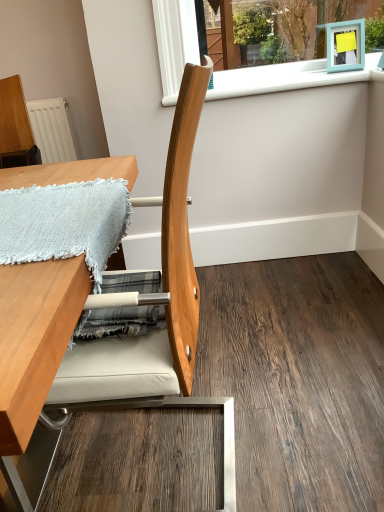
The image size is (384, 512). Describe the element at coordinates (33, 348) in the screenshot. I see `wooden table at left` at that location.

Locate an element on the screen. light blue woven blanket at upper left is located at coordinates (65, 223).

Is white plastic window sill at upper center positioned far away from wooden table at left?

No, white plastic window sill at upper center is not far away from wooden table at left.

Can you confirm if white plastic window sill at upper center is positioned to the right of wooden table at left?

Correct, you'll find white plastic window sill at upper center to the right of wooden table at left.

Which of these two, white plastic window sill at upper center or wooden table at left, stands taller?

Standing taller between the two is wooden table at left.

How different are the orientations of white plastic window sill at upper center and wooden table at left in degrees?

89.4 degrees.

From a real-world perspective, which object rests below the other?

light blue woven blanket at upper left.

Is white plastic window sill at upper center beside light blue woven blanket at upper left?

No.

Could light blue woven blanket at upper left be considered to be inside white plastic window sill at upper center?

No, light blue woven blanket at upper left is not inside white plastic window sill at upper center.

This screenshot has height=512, width=384. In order to click on window sill behind the light blue woven blanket at upper left in this screenshot , I will do `click(288, 78)`.

In terms of height, does light blue woven blanket at upper left look taller or shorter compared to natural wood chair at center?

In the image, light blue woven blanket at upper left appears to be shorter than natural wood chair at center.

Is light blue woven blanket at upper left facing away from natural wood chair at center?

Yes, light blue woven blanket at upper left is positioned with its back facing natural wood chair at center.

From the image's perspective, is light blue woven blanket at upper left positioned above or below natural wood chair at center?

Based on their image positions, light blue woven blanket at upper left is located above natural wood chair at center.

Choose the correct answer: Is light blue woven blanket at upper left inside natural wood chair at center or outside it?

The correct answer is: inside.

Can we say natural wood chair at center lies outside white plastic window sill at upper center?

Yes.

From the picture: From a real-world perspective, is natural wood chair at center positioned under white plastic window sill at upper center based on gravity?

Yes, from a real-world perspective, natural wood chair at center is below white plastic window sill at upper center.

At what (x,y) coordinates should I click in order to perform the action: click on chair beneath the white plastic window sill at upper center (from a real-world perspective). Please return your answer as a coordinate pair (x, y). This screenshot has width=384, height=512. Looking at the image, I should click on (156, 311).

Is natural wood chair at center far away from white plastic window sill at upper center?

Yes, natural wood chair at center and white plastic window sill at upper center are quite far apart.

Is wooden table at left far away from natural wood chair at center?

Actually, wooden table at left and natural wood chair at center are a little close together.

Considering the sizes of wooden table at left and natural wood chair at center in the image, is wooden table at left taller or shorter than natural wood chair at center?

wooden table at left is shorter than natural wood chair at center.

Considering the relative positions of wooden table at left and natural wood chair at center in the image provided, is wooden table at left to the left of natural wood chair at center from the viewer's perspective?

Indeed, wooden table at left is positioned on the left side of natural wood chair at center.

Is wooden table at left oriented towards natural wood chair at center?

Yes, wooden table at left is facing natural wood chair at center.

Consider the image. Who is bigger, light blue woven blanket at upper left or wooden table at left?

Bigger between the two is wooden table at left.

Is wooden table at left surrounded by light blue woven blanket at upper left?

No, wooden table at left is not surrounded by light blue woven blanket at upper left.

There is a wooden table at left. Where is `blanket above it (from a real-world perspective)`? The image size is (384, 512). blanket above it (from a real-world perspective) is located at coordinates (65, 223).

From the picture: Which object is closer to the camera taking this photo, white plastic window sill at upper center or natural wood chair at center?

natural wood chair at center is closer to the camera.

Is natural wood chair at center at the back of white plastic window sill at upper center?

No, natural wood chair at center is not at the back of white plastic window sill at upper center.

Between white plastic window sill at upper center and natural wood chair at center, which one has larger size?

Bigger between the two is natural wood chair at center.

The width and height of the screenshot is (384, 512). Identify the location of table below the white plastic window sill at upper center (from the image's perspective). (33, 348).

Locate an element on the screen. blanket in front of the white plastic window sill at upper center is located at coordinates (65, 223).

When comparing their distances from wooden table at left, does light blue woven blanket at upper left or natural wood chair at center seem further?

natural wood chair at center lies further to wooden table at left than the other object.

Estimate the real-world distances between objects in this image. Which object is closer to white plastic window sill at upper center, natural wood chair at center or light blue woven blanket at upper left?

light blue woven blanket at upper left is closer to white plastic window sill at upper center.

Based on their spatial positions, is natural wood chair at center or white plastic window sill at upper center further from light blue woven blanket at upper left?

The object further to light blue woven blanket at upper left is white plastic window sill at upper center.

Estimate the real-world distances between objects in this image. Which object is further from light blue woven blanket at upper left, natural wood chair at center or wooden table at left?

natural wood chair at center is further to light blue woven blanket at upper left.

From the image, which object appears to be farther from natural wood chair at center, wooden table at left or light blue woven blanket at upper left?

wooden table at left is positioned further to the anchor natural wood chair at center.

Looking at the image, which one is located closer to white plastic window sill at upper center, wooden table at left or light blue woven blanket at upper left?

The object closer to white plastic window sill at upper center is wooden table at left.

Which object lies nearer to the anchor point natural wood chair at center, white plastic window sill at upper center or wooden table at left?

Based on the image, wooden table at left appears to be nearer to natural wood chair at center.

Looking at the image, which one is located further to light blue woven blanket at upper left, white plastic window sill at upper center or wooden table at left?

white plastic window sill at upper center is positioned further to the anchor light blue woven blanket at upper left.

The image size is (384, 512). Identify the location of blanket positioned between natural wood chair at center and white plastic window sill at upper center from near to far. (65, 223).

This screenshot has width=384, height=512. What are the coordinates of `blanket positioned between wooden table at left and white plastic window sill at upper center from near to far` in the screenshot? It's located at (65, 223).

The image size is (384, 512). Find the location of `chair between light blue woven blanket at upper left and wooden table at left in the vertical direction`. chair between light blue woven blanket at upper left and wooden table at left in the vertical direction is located at coordinates (156, 311).

Image resolution: width=384 pixels, height=512 pixels. I want to click on chair between wooden table at left and white plastic window sill at upper center in the front-back direction, so click(156, 311).